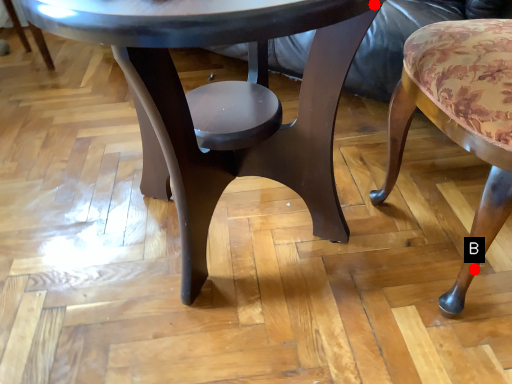
Question: Two points are circled on the image, labeled by A and B beside each circle. Which of the following is the farthest from the observer?

Choices:
 (A) A is further
 (B) B is further

Answer: (B)